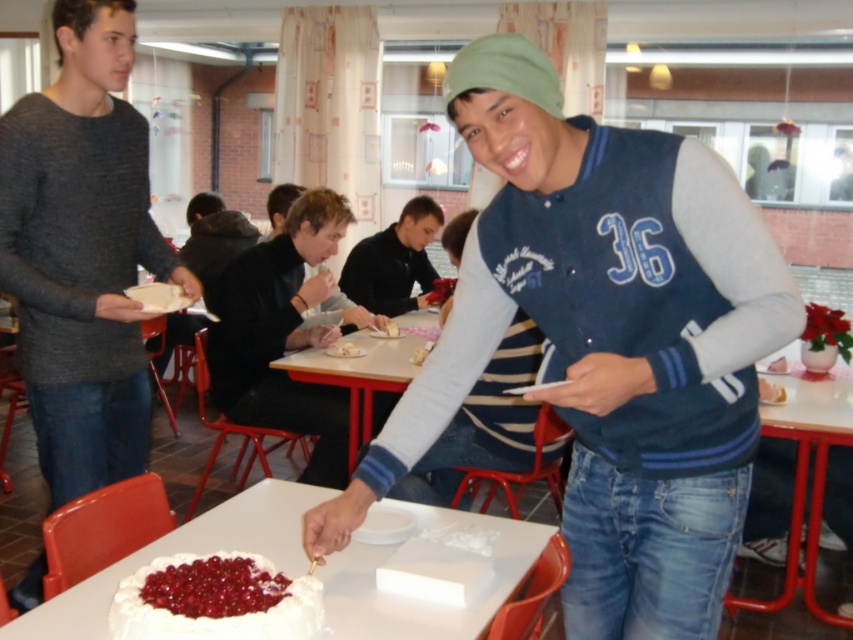
Which is more to the right, blue jersey at center or wooden table at center?

From the viewer's perspective, blue jersey at center appears more on the right side.

Is blue jersey at center further to camera compared to wooden table at center?

No, blue jersey at center is closer to the viewer.

Is point (611, 244) in front of point (351, 433)?

Yes, it is.

The image size is (853, 640). Find the location of `blue jersey at center`. blue jersey at center is located at coordinates (605, 342).

Which is in front, point (219, 285) or point (345, 349)?

Point (219, 285) is more forward.

Who is higher up, black leather jacket at center or white creamy cake at center?

black leather jacket at center

Is point (288, 230) more distant than point (328, 352)?

That is True.

The width and height of the screenshot is (853, 640). Find the location of `black leather jacket at center`. black leather jacket at center is located at coordinates (282, 333).

Does point (837, 392) lie behind point (408, 349)?

That is False.

Is point (817, 435) positioned behind point (415, 321)?

No, (817, 435) is in front of (415, 321).

This screenshot has width=853, height=640. Find the location of `white plastic table at lower right`. white plastic table at lower right is located at coordinates (x=805, y=470).